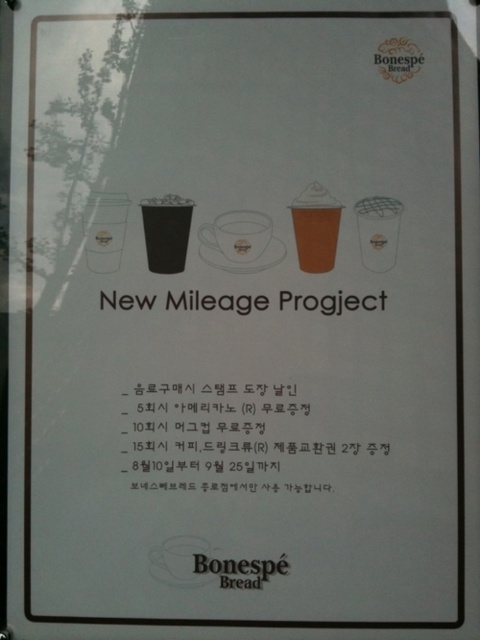
You are designing a layout for the promotional poster and need to place a new element exactly where the black matte cup at center is currently located. What are the coordinates of this position?

The position of the black matte cup at center is at point (166, 230).